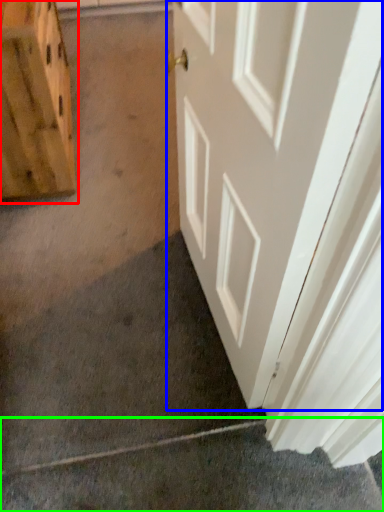
Question: Based on their relative distances, which object is farther from cabinetry (highlighted by a red box)? Choose from door (highlighted by a blue box) and concrete (highlighted by a green box).

Choices:
 (A) door
 (B) concrete

Answer: (B)